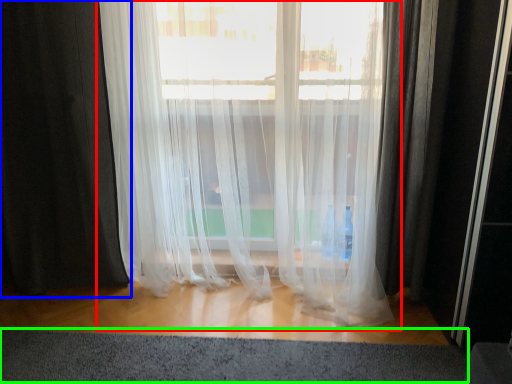
Question: Which object is the closest to the curtain (highlighted by a red box)? Choose among these: curtain (highlighted by a blue box) or gray (highlighted by a green box).

Choices:
 (A) curtain
 (B) gray

Answer: (A)